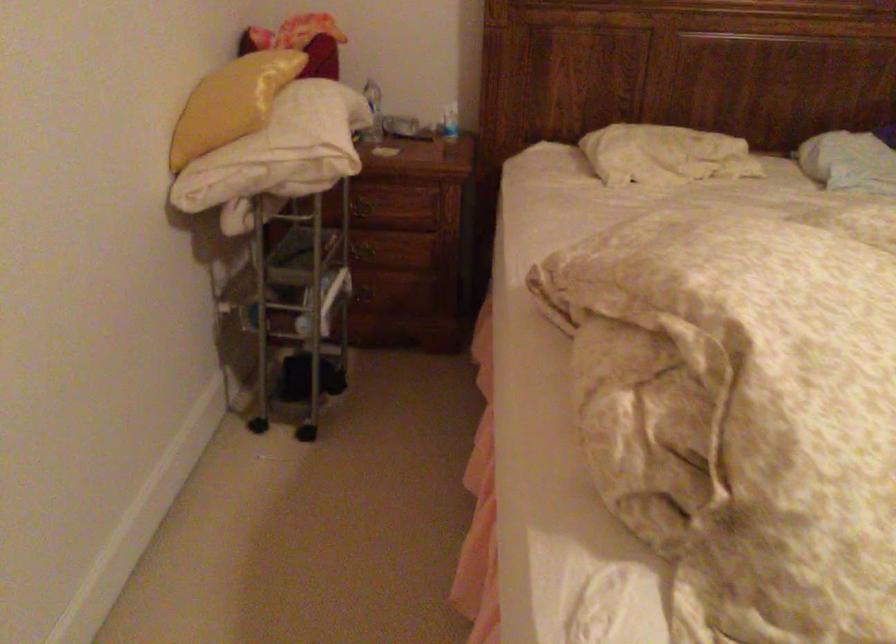
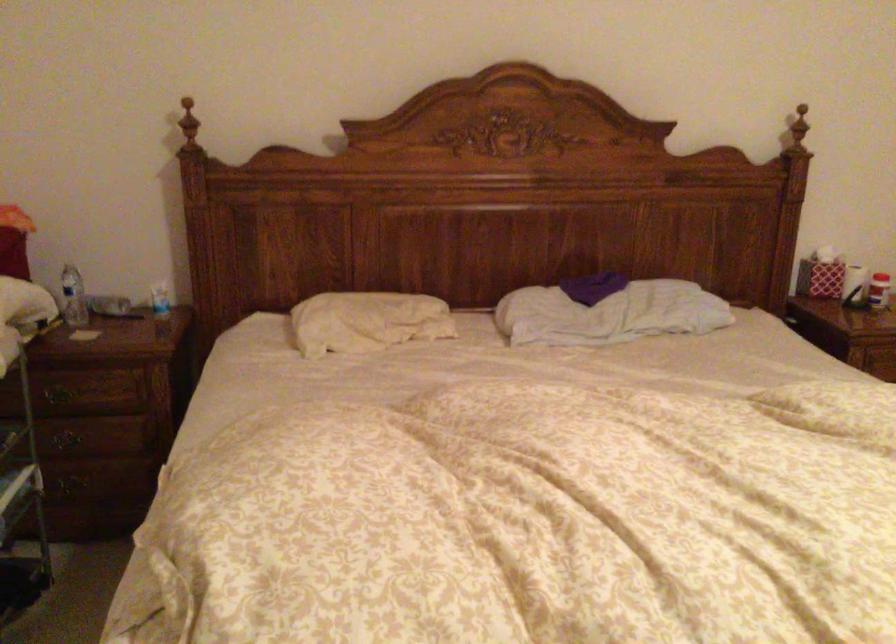
Question: Based on the continuous images, in which direction is the camera rotating? Reply with the corresponding letter.

Choices:
 (A) Left
 (B) Right
 (C) Up
 (D) Down

Answer: (B)